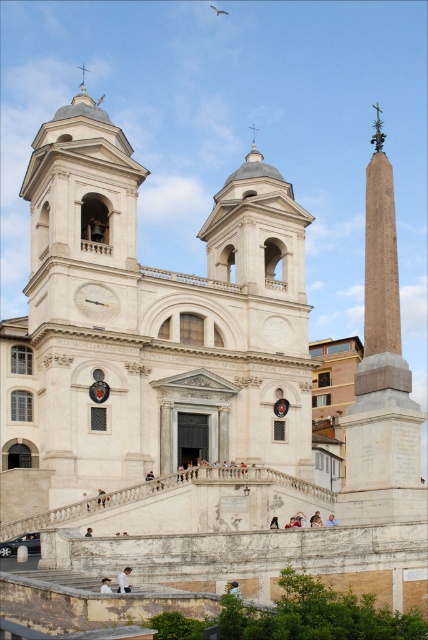
Question: Does smooth stone obelisk at right appear over white fabric person at lower center?

Choices:
 (A) no
 (B) yes

Answer: (B)

Question: Can you confirm if smooth stone obelisk at right is smaller than white fabric person at lower center?

Choices:
 (A) yes
 (B) no

Answer: (B)

Question: Based on their relative distances, which object is nearer to the blue denim jeans at lower center?

Choices:
 (A) white fabric person at lower center
 (B) light brown leather jacket at center

Answer: (B)

Question: Does smooth stone obelisk at right come behind light brown leather jacket at center?

Choices:
 (A) no
 (B) yes

Answer: (B)

Question: Estimate the real-world distances between objects in this image. Which object is farther from the smooth stone obelisk at right?

Choices:
 (A) white fabric person at lower center
 (B) blue denim jeans at lower center
 (C) light brown leather jacket at center

Answer: (A)

Question: Which point appears closest to the camera in this image?

Choices:
 (A) (109, 580)
 (B) (410, 419)

Answer: (A)